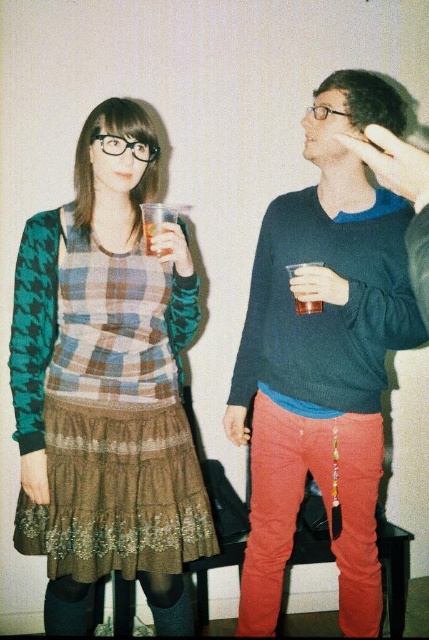
Question: Is plaid fabric dress at center positioned before translucent plastic cup at right?

Choices:
 (A) yes
 (B) no

Answer: (A)

Question: Considering the real-world distances, which object is closest to the translucent plastic cup at center?

Choices:
 (A) plaid fabric dress at center
 (B) matte blue sweater at center

Answer: (A)

Question: Which point is farther from the camera taking this photo?

Choices:
 (A) (148, 221)
 (B) (343, 522)
 (C) (156, 257)
 (D) (293, 264)

Answer: (B)

Question: Which object appears farthest from the camera in this image?

Choices:
 (A) matte blue sweater at center
 (B) translucent plastic cup at right

Answer: (B)

Question: Is translucent plastic cup at center wider than translucent plastic cup at right?

Choices:
 (A) no
 (B) yes

Answer: (A)

Question: In this image, where is matte blue sweater at center located relative to translucent plastic cup at center?

Choices:
 (A) right
 (B) left

Answer: (A)